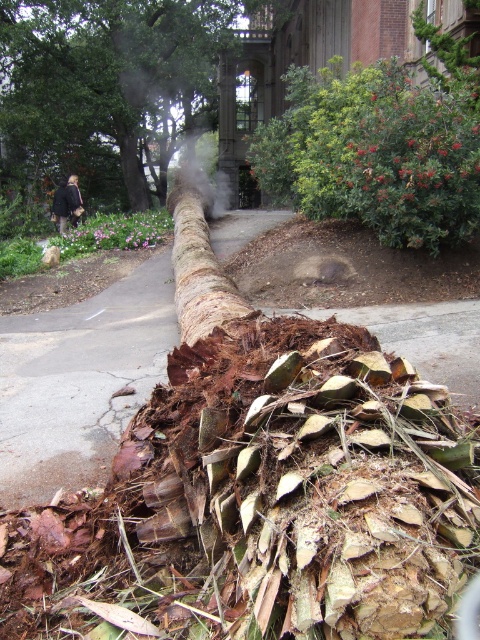
You are standing on the pathway looking at the fallen tree trunk. There are two points marked on the trunk, one at coordinates point (215,212) and another at point (67,189). Which point is closer to you?

Point (215,212) is closer to the camera than point (67,189), so the point at coordinates point (215,212) is closer to you.

You are standing on the gray concrete pavement at center and want to pick up the dark brown leather jacket at upper left. Which direction should you move to reach it?

Since the gray concrete pavement at center is closer to the viewer than the dark brown leather jacket at upper left, you should move forward towards the jacket as it is located further away from your current position.

You are a delivery person with a cart that is 1.2 meters wide. You need to move from the gray concrete pavement at center to the building in the background. Can you pass through the area near the fallen tree trunk without your cart getting stuck?

The distance between the gray concrete pavement at center and the camera is 3.75 meters. Since the cart is only 1.2 meters wide, there is enough space for the cart to pass through the area near the fallen tree trunk without getting stuck.